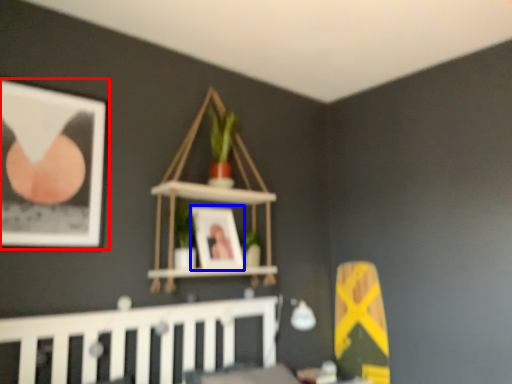
Question: Which point is further to the camera, picture frame (highlighted by a red box) or picture frame (highlighted by a blue box)?

Choices:
 (A) picture frame
 (B) picture frame

Answer: (B)